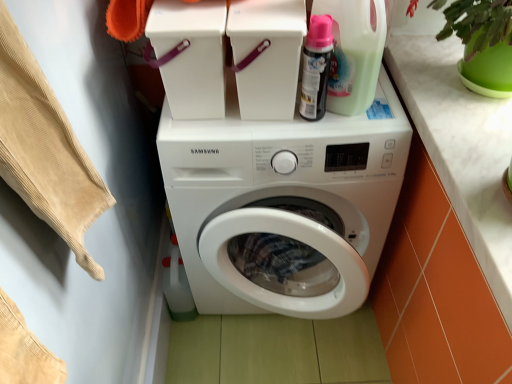
This screenshot has width=512, height=384. What are the coordinates of `free spot in front of translucent plastic detergent bottle at upper right, the 1th cleaning product in the right-to-left sequence` in the screenshot? It's located at (350, 131).